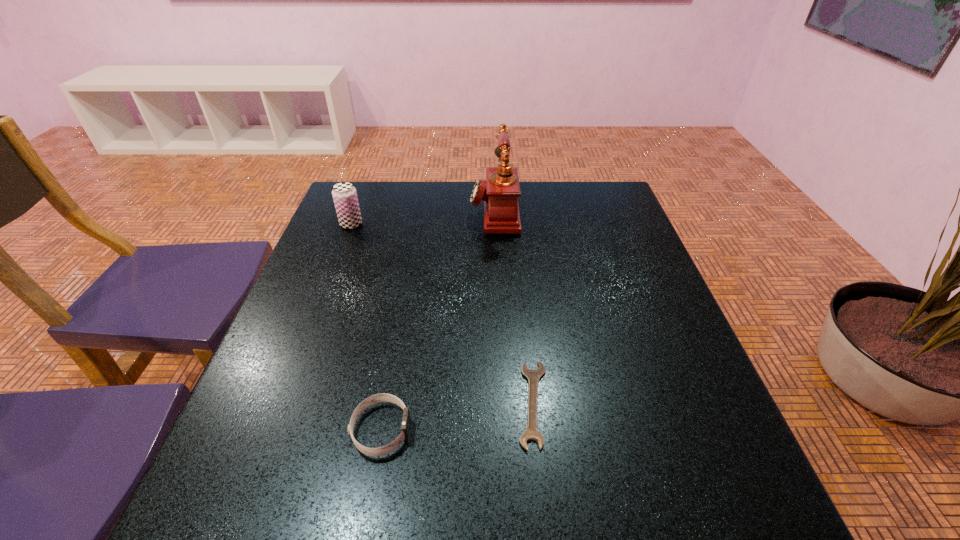
This screenshot has height=540, width=960. What are the coordinates of `blank space at the far right corner of the desktop` in the screenshot? It's located at (600, 193).

Locate an element on the screen. unoccupied area between the third shortest object and the shortest object is located at coordinates (443, 314).

Locate an element on the screen. The width and height of the screenshot is (960, 540). vacant space in between the third object from right to left and the second tallest object is located at coordinates (366, 327).

Identify the location of vacant area between the wristband and the leftmost object. (366, 327).

Find the location of `free spot between the third shortest object and the tallest object`. free spot between the third shortest object and the tallest object is located at coordinates click(x=422, y=218).

You are a GUI agent. You are given a task and a screenshot of the screen. Output one action in this format:
    pyautogui.click(x=<x>, y=<y>)
    Task: Click on the unoccupied position between the wrench and the second object from left to right
    
    Given the screenshot: What is the action you would take?
    pyautogui.click(x=457, y=416)

In order to click on free point between the telephone and the wristband in this screenshot , I will do `click(438, 320)`.

Locate an element on the screen. free space between the beer can and the tallest object is located at coordinates (422, 218).

You are a GUI agent. You are given a task and a screenshot of the screen. Output one action in this format:
    pyautogui.click(x=<x>, y=<y>)
    Task: Click on the free space between the telephone and the second tallest object
    
    Given the screenshot: What is the action you would take?
    pyautogui.click(x=422, y=218)

What are the coordinates of `vacant space that's between the telephone and the shortest object` in the screenshot? It's located at (514, 307).